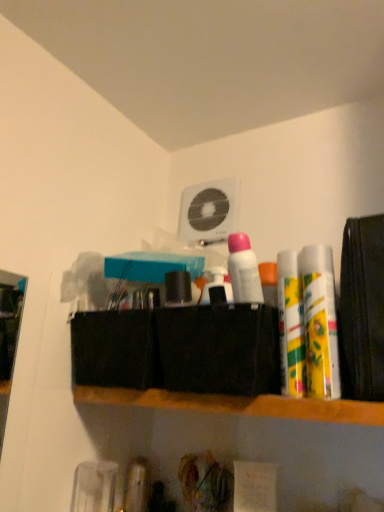
Question: Looking at their shapes, would you say wooden shelf at center is wider or thinner than white matte deodorant at center, acting as the first toiletry starting from the left?

Choices:
 (A) wide
 (B) thin

Answer: (A)

Question: In terms of size, does wooden shelf at center appear bigger or smaller than white matte deodorant at center, acting as the first toiletry starting from the left?

Choices:
 (A) small
 (B) big

Answer: (B)

Question: Which is farther from the wooden shelf at center?

Choices:
 (A) yellow-green plastic spray cans at right, the 2th toiletry when ordered from right to left
 (B) yellow matte lip balm at right, the first toiletry when ordered from right to left
 (C) white matte deodorant at center, placed as the 3th toiletry when sorted from right to left
 (D) white plastic fan at upper center

Answer: (D)

Question: Which object is positioned farthest from the yellow-green plastic spray cans at right, the 2th toiletry when ordered from right to left?

Choices:
 (A) wooden shelf at center
 (B) white matte deodorant at center, acting as the first toiletry starting from the left
 (C) white plastic fan at upper center
 (D) yellow matte lip balm at right, which appears as the third toiletry when viewed from the left

Answer: (C)